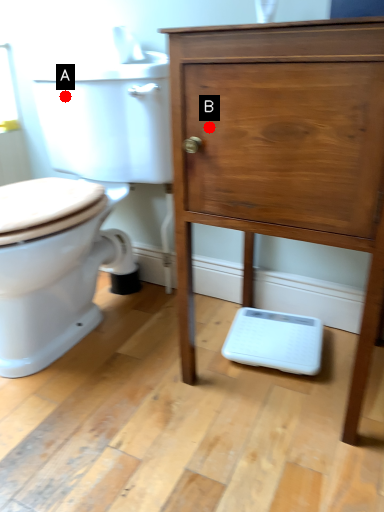
Question: Two points are circled on the image, labeled by A and B beside each circle. Which point is closer to the camera?

Choices:
 (A) A is closer
 (B) B is closer

Answer: (B)